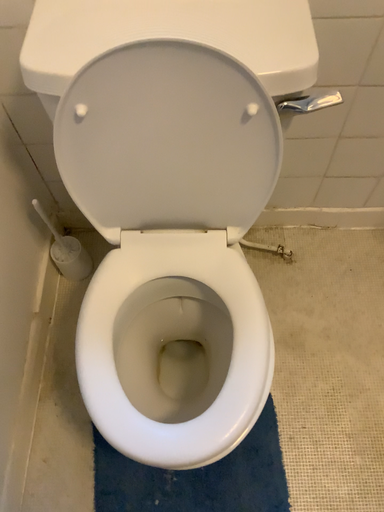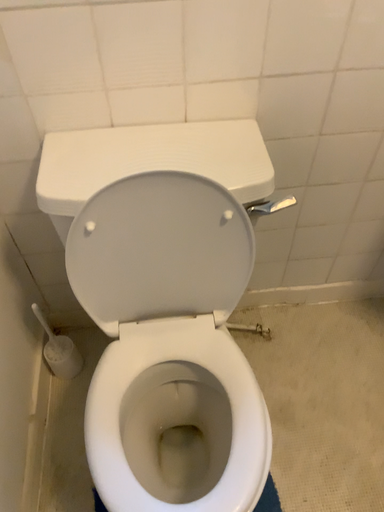
Question: Which way did the camera rotate in the video?

Choices:
 (A) rotated upward
 (B) rotated downward

Answer: (A)